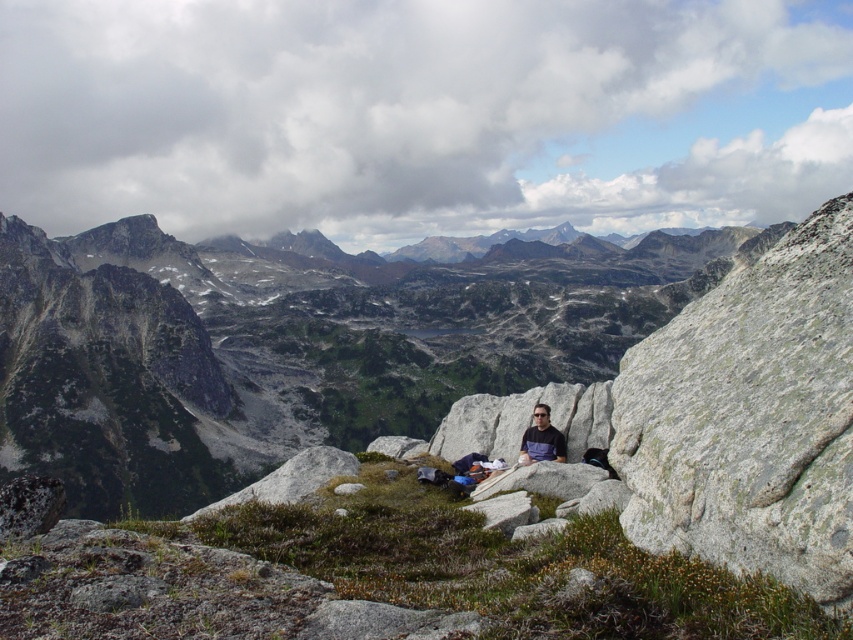
You are a hiker who needs to sit down for a rest. You see the gray rock at center and the matte gray shirt at center. Which one is a better option to sit on if you want something larger?

The gray rock at center is bigger than the matte gray shirt at center, so it is a better option to sit on if you want something larger.

From the picture: You are a hiker who wants to place a small backpack on the ground near the gray rock at center and the matte gray shirt at center. Which object should you place it closer to if you want it to be more visible to someone approaching from the front?

You should place the backpack closer to the gray rock at center because it is closer to the viewer than the matte gray shirt at center, making it more visible to someone approaching from the front.